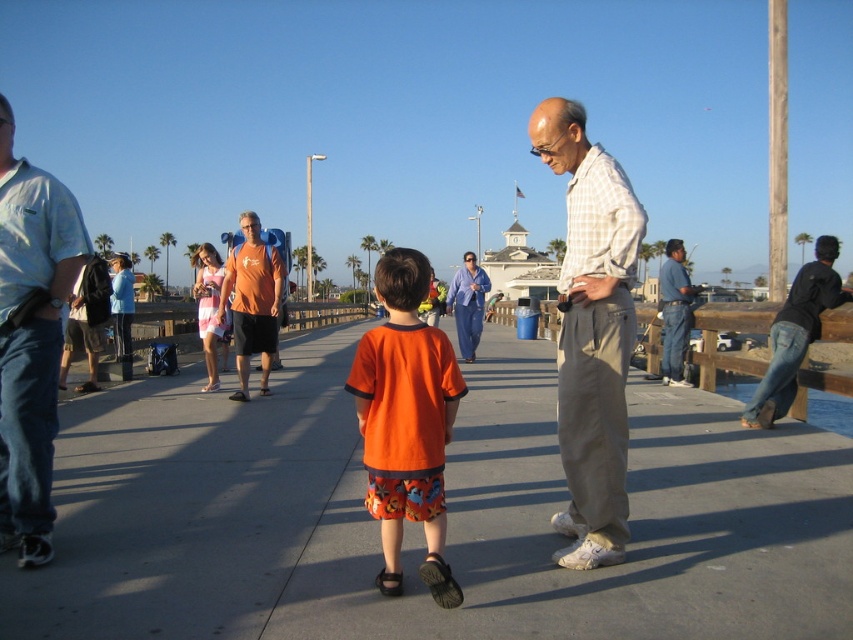
Between point (314, 362) and point (669, 257), which one is positioned in front?

Point (669, 257)

Who is more distant from viewer, [96,632] or [668,248]?

Point [668,248]

What do you see at coordinates (418, 525) in the screenshot?
I see `smooth concrete pavement at center` at bounding box center [418, 525].

I want to click on smooth concrete pavement at center, so click(418, 525).

In the scene shown: Who is more forward, (x=6, y=289) or (x=790, y=317)?

Positioned in front is point (x=6, y=289).

Looking at this image, who is lower down, light blue cotton shirt at left or black leather jacket at right?

light blue cotton shirt at left is below.

Which is in front, point (22, 516) or point (788, 291)?

Positioned in front is point (22, 516).

Image resolution: width=853 pixels, height=640 pixels. Find the location of `light blue cotton shirt at left`. light blue cotton shirt at left is located at coordinates (32, 339).

Can you confirm if smooth concrete pavement at center is bigger than orange cotton shirt at center?

Correct, smooth concrete pavement at center is larger in size than orange cotton shirt at center.

At what (x,y) coordinates should I click in order to perform the action: click on smooth concrete pavement at center. Please return your answer as a coordinate pair (x, y). Looking at the image, I should click on (418, 525).